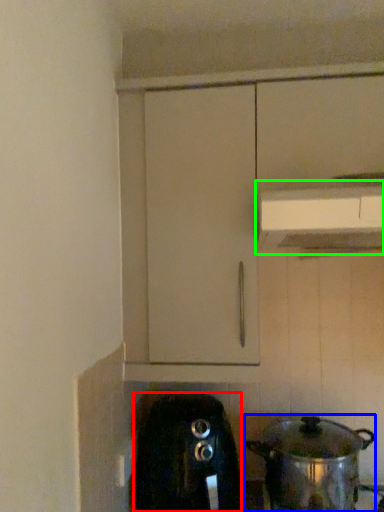
Question: Which is farther away from home appliance (highlighted by a red box)? kitchen appliance (highlighted by a blue box) or vent (highlighted by a green box)?

Choices:
 (A) kitchen appliance
 (B) vent

Answer: (B)